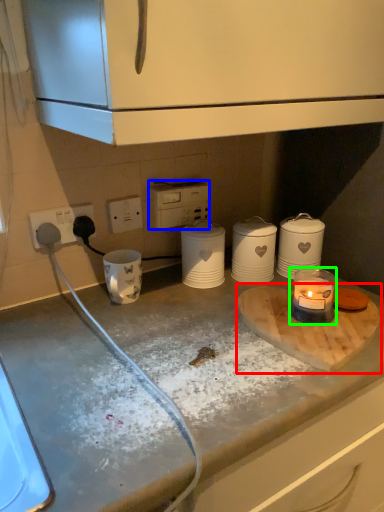
Question: Considering the real-world distances, which object is closest to cutting board (highlighted by a red box)? appliance (highlighted by a blue box) or candle holder (highlighted by a green box).

Choices:
 (A) appliance
 (B) candle holder

Answer: (B)